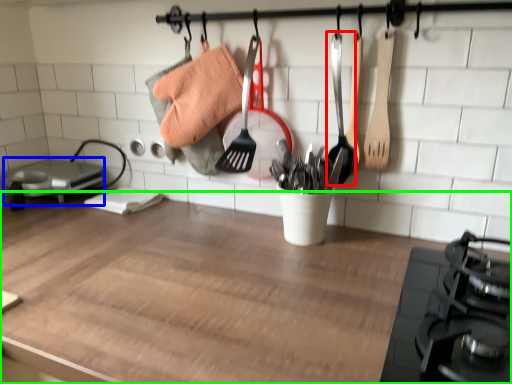
Question: Which object is positioned farthest from utensil (highlighted by a red box)? Select from appliance (highlighted by a blue box) and countertop (highlighted by a green box).

Choices:
 (A) appliance
 (B) countertop

Answer: (A)